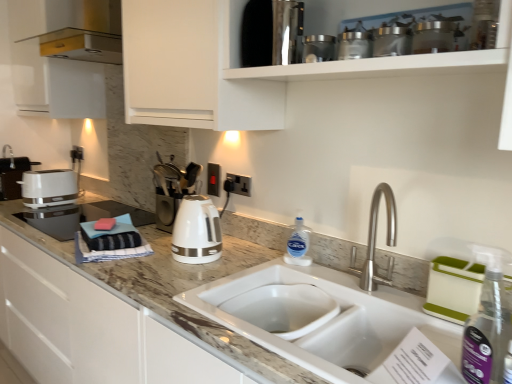
This screenshot has width=512, height=384. In order to click on free space above white glossy toaster at left (from a real-world perspective) in this screenshot , I will do `click(42, 169)`.